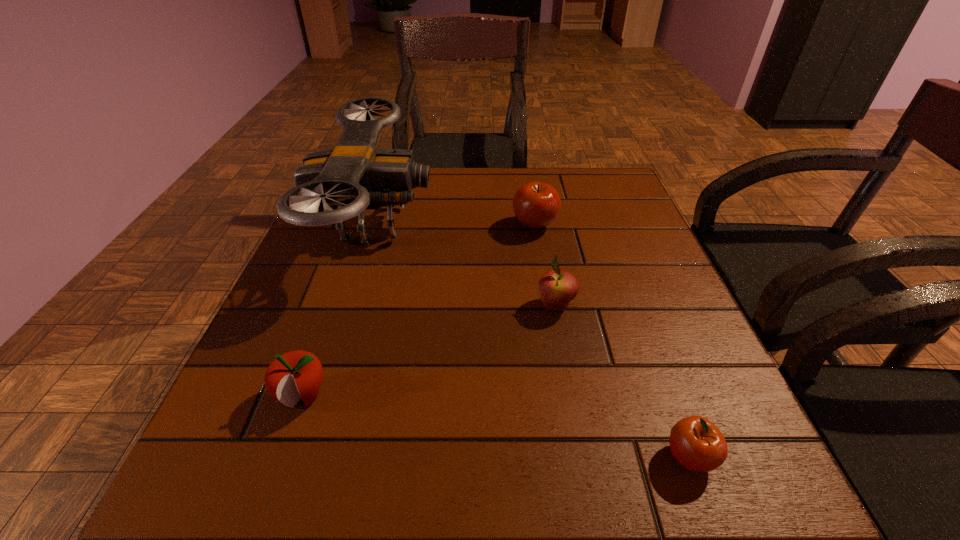
I want to click on vacant space that satisfies the following two spatial constraints: 1. on the front side of the nearest object; 2. on the left side of the third farthest apple, so click(281, 457).

The height and width of the screenshot is (540, 960). Find the location of `blank area in the image that satisfies the following two spatial constraints: 1. on the back side of the second farthest apple; 2. on the front-facing side of the drone`. blank area in the image that satisfies the following two spatial constraints: 1. on the back side of the second farthest apple; 2. on the front-facing side of the drone is located at coordinates (540, 225).

Identify the location of free space in the image that satisfies the following two spatial constraints: 1. on the front-facing side of the drone; 2. on the right side of the farthest apple. (374, 225).

Find the location of a particular element. The width and height of the screenshot is (960, 540). free space that satisfies the following two spatial constraints: 1. on the front-facing side of the drone; 2. on the right side of the farthest apple is located at coordinates (374, 225).

Where is `free location that satisfies the following two spatial constraints: 1. on the front-facing side of the drone; 2. on the left side of the rightmost apple`? This screenshot has height=540, width=960. free location that satisfies the following two spatial constraints: 1. on the front-facing side of the drone; 2. on the left side of the rightmost apple is located at coordinates (300, 457).

The width and height of the screenshot is (960, 540). I want to click on vacant space that satisfies the following two spatial constraints: 1. on the front side of the farthest apple; 2. on the left side of the third nearest apple, so click(x=547, y=306).

The width and height of the screenshot is (960, 540). Find the location of `vacant space that satisfies the following two spatial constraints: 1. on the back side of the nearest apple; 2. on the front-facing side of the tallest object`. vacant space that satisfies the following two spatial constraints: 1. on the back side of the nearest apple; 2. on the front-facing side of the tallest object is located at coordinates (604, 225).